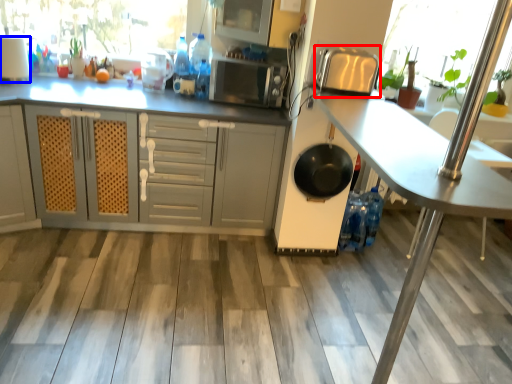
Question: Which point is further to the camera, appliance (highlighted by a red box) or appliance (highlighted by a blue box)?

Choices:
 (A) appliance
 (B) appliance

Answer: (B)